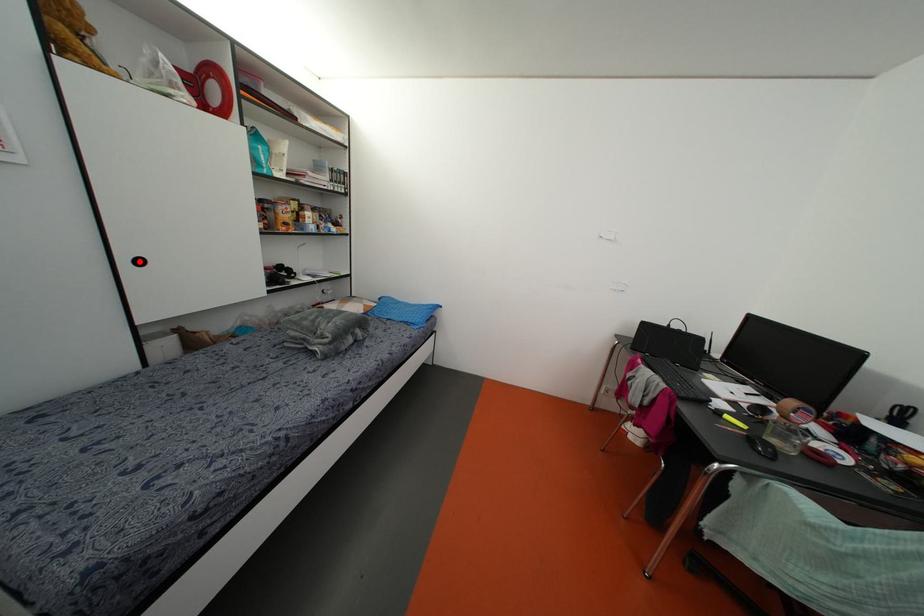
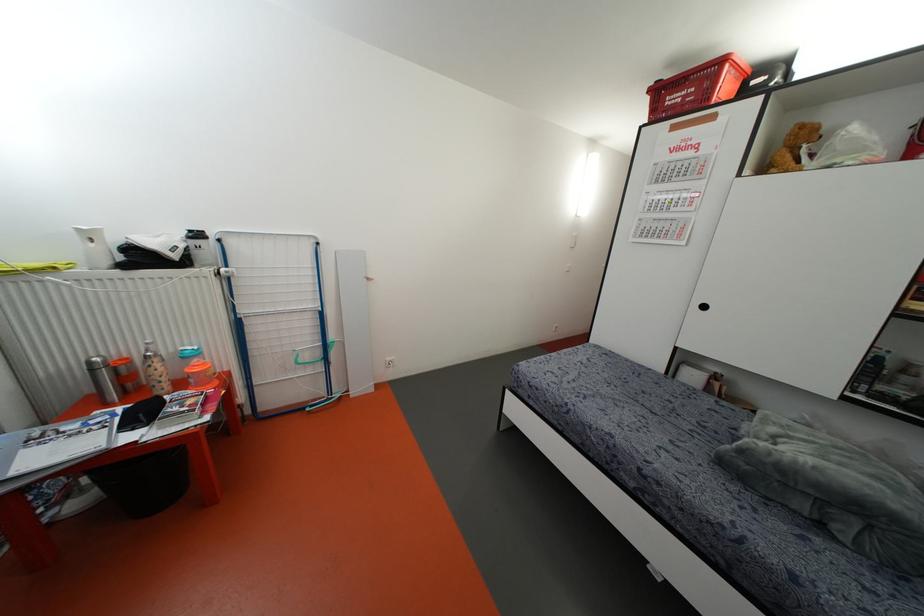
Locate, in the second image, the point that corresponds to the highlighted location in the first image.

(703, 307)